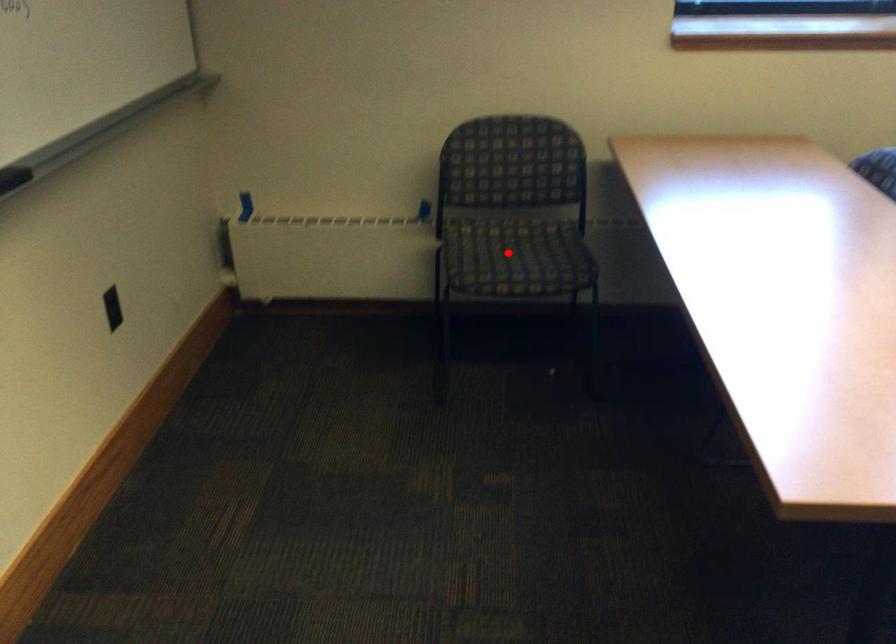
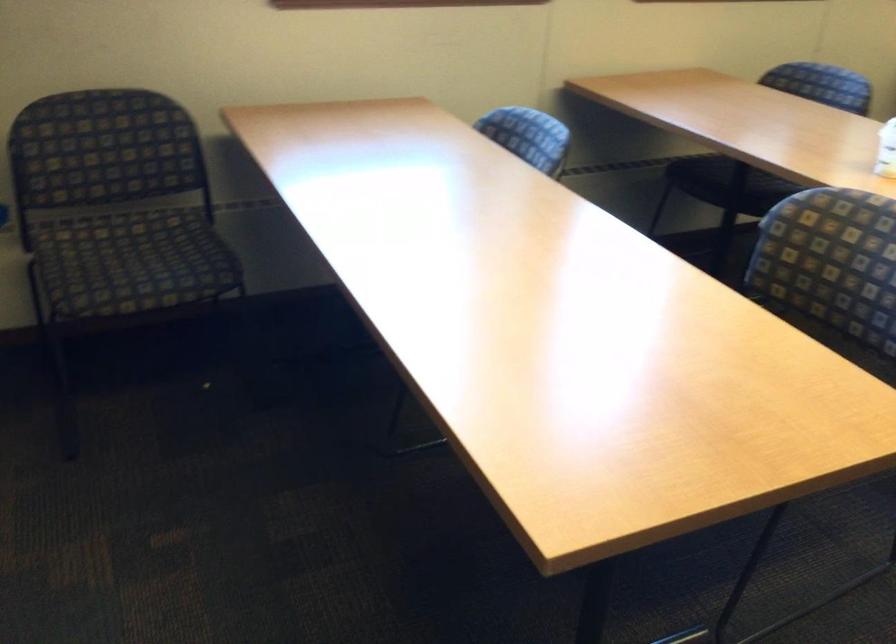
Question: I am providing you with two images of the same scene from different viewpoints. A red point is shown in image1. For the corresponding object point in image2, is it positioned nearer or farther from the camera?

Choices:
 (A) Nearer
 (B) Farther

Answer: (A)